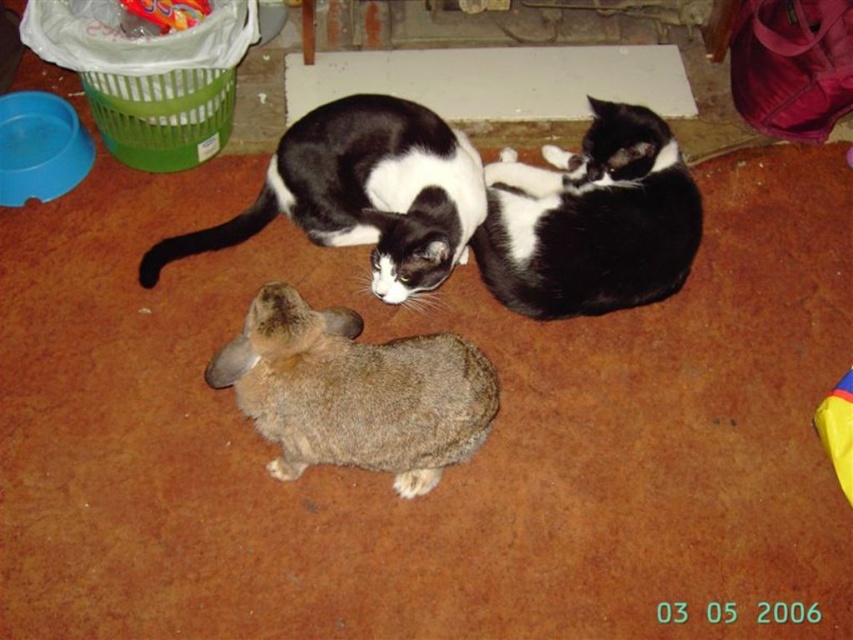
Based on the scene description, what are the coordinates of the fuzzy brown rabbit at center?

The fuzzy brown rabbit at center is located at coordinates point (355, 392).

You are a photographer trying to capture a closeup of the black and white fur cat at center without the black and white fur cat at upper center blocking the view. Which cat should you focus on to ensure the other is not in front?

The black and white fur cat at upper center is behind the black and white fur cat at center, so focusing on the black and white fur cat at center will keep the other cat from blocking the view.